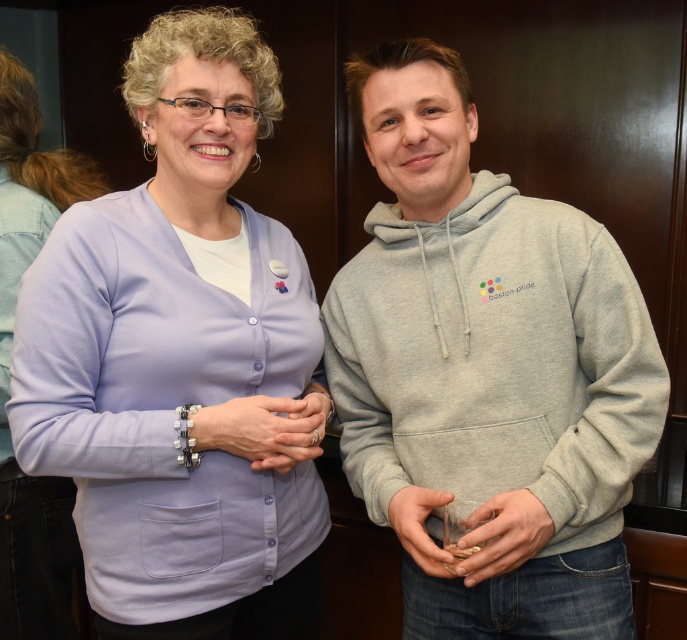
Does lavender fabric cardigan at upper left appear over matte gray hoodie at center?

Yes, lavender fabric cardigan at upper left is above matte gray hoodie at center.

In the scene shown: Which of these two, lavender fabric cardigan at upper left or matte gray hoodie at center, stands shorter?

With less height is matte gray hoodie at center.

This screenshot has width=687, height=640. What do you see at coordinates (179, 356) in the screenshot? I see `lavender fabric cardigan at upper left` at bounding box center [179, 356].

At what (x,y) coordinates should I click in order to perform the action: click on lavender fabric cardigan at upper left. Please return your answer as a coordinate pair (x, y). Looking at the image, I should click on (179, 356).

Does gray heathered hoodie at center come behind matte gray hoodie at center?

Yes, gray heathered hoodie at center is further from the viewer.

How far apart are gray heathered hoodie at center and matte gray hoodie at center?

gray heathered hoodie at center and matte gray hoodie at center are 10.34 inches apart.

Identify the location of gray heathered hoodie at center. (488, 358).

Does gray heathered hoodie at center have a lesser height compared to matte gray phone at lower center?

No, gray heathered hoodie at center is not shorter than matte gray phone at lower center.

Is gray heathered hoodie at center taller than matte gray phone at lower center?

Correct, gray heathered hoodie at center is much taller as matte gray phone at lower center.

Is point (596, 285) in front of point (436, 490)?

That is False.

This screenshot has width=687, height=640. I want to click on gray heathered hoodie at center, so click(x=488, y=358).